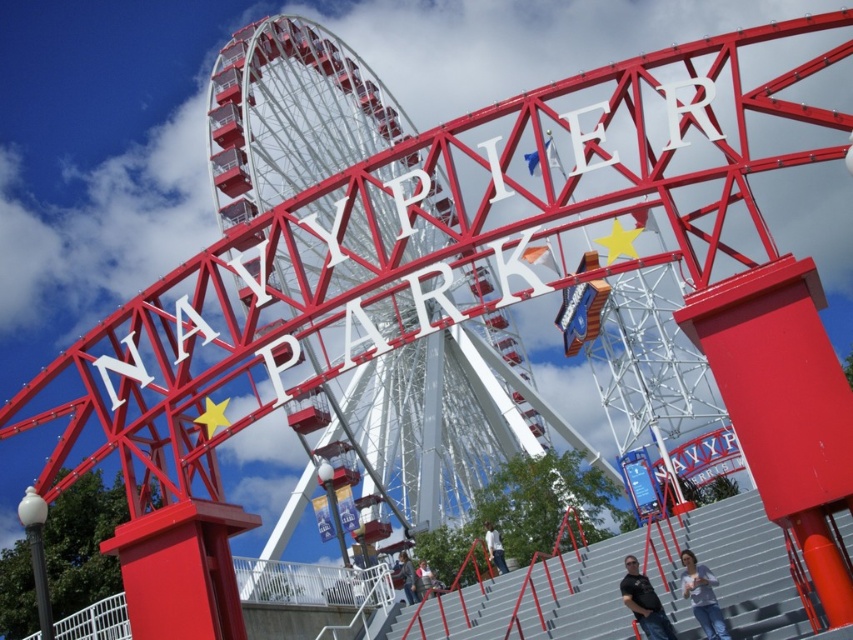
Consider the image. Can you confirm if light blue shirt at lower right is positioned below black matte shirt at lower center?

Incorrect, light blue shirt at lower right is not positioned below black matte shirt at lower center.

Does light blue shirt at lower right have a greater width compared to black matte shirt at lower center?

In fact, light blue shirt at lower right might be narrower than black matte shirt at lower center.

Where is `light blue shirt at lower right`? The width and height of the screenshot is (853, 640). light blue shirt at lower right is located at coordinates (701, 595).

You are a GUI agent. You are given a task and a screenshot of the screen. Output one action in this format:
    pyautogui.click(x=<x>, y=<y>)
    Task: Click on the denim jacket at lower center
    Image resolution: width=853 pixels, height=640 pixels.
    Given the screenshot: What is the action you would take?
    pyautogui.click(x=405, y=577)

Which is more to the left, gray metallic stairs at center or black matte shirt at lower center?

From the viewer's perspective, gray metallic stairs at center appears more on the left side.

Is gray metallic stairs at center further to the viewer compared to black matte shirt at lower center?

That is False.

This screenshot has width=853, height=640. What do you see at coordinates (746, 566) in the screenshot? I see `gray metallic stairs at center` at bounding box center [746, 566].

The height and width of the screenshot is (640, 853). What are the coordinates of `gray metallic stairs at center` in the screenshot? It's located at (746, 566).